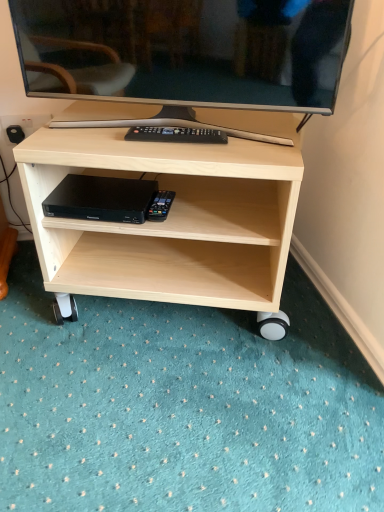
Identify the location of blank space situated above light wood shelf at center (from a real-world perspective). Image resolution: width=384 pixels, height=512 pixels. (170, 122).